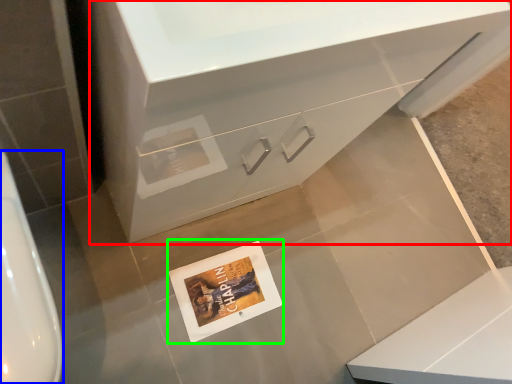
Question: Which is farther away from bathroom cabinet (highlighted by a red box)? urinal (highlighted by a blue box) or postcard (highlighted by a green box)?

Choices:
 (A) urinal
 (B) postcard

Answer: (B)